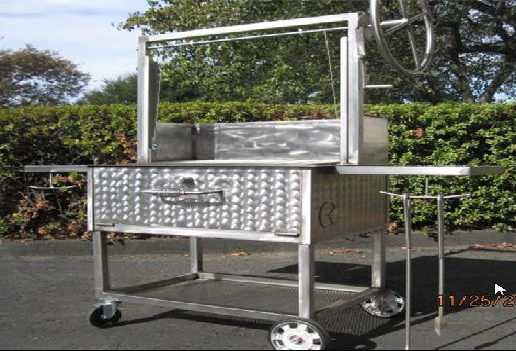
Identify the location of metal cart bottom tray. The image size is (516, 351). (239, 292).